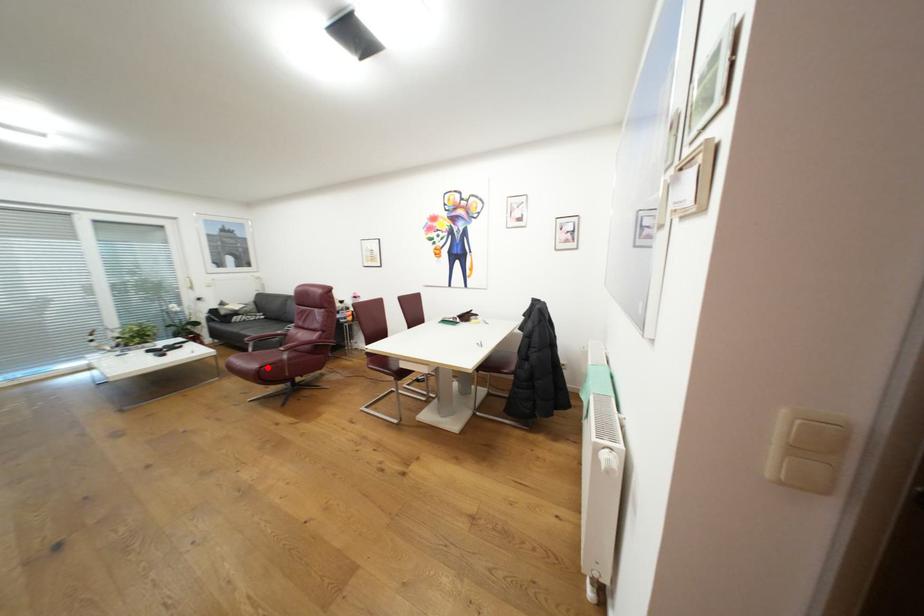
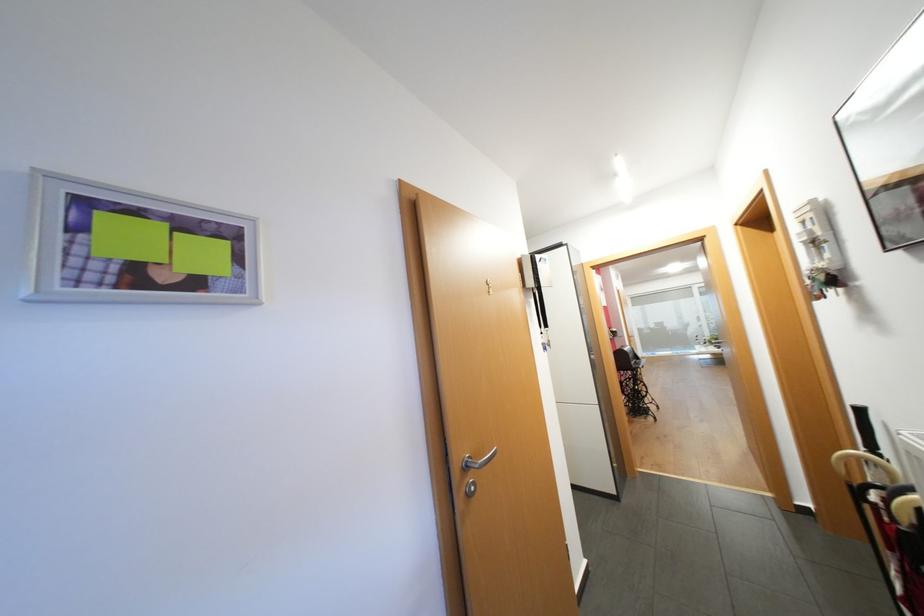
Question: I am providing you with two images of the same scene from different viewpoints. A red point is marked on the first image. At the location where the point appears in image 1, is it still visible in image 2?

Choices:
 (A) Yes
 (B) No

Answer: (B)